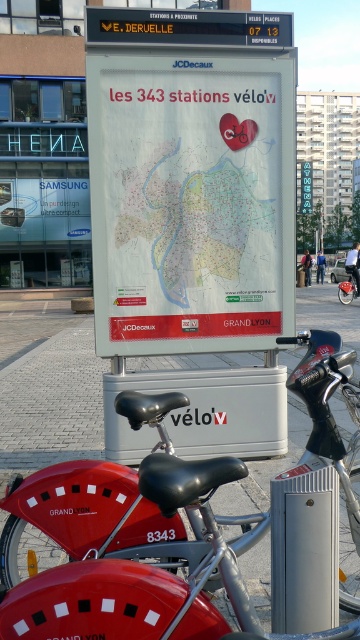
You are a tourist in Lyon and you see the white paper map at center. Where exactly is it located on the image?

The white paper map at center is located at point coordinates of [186,209].